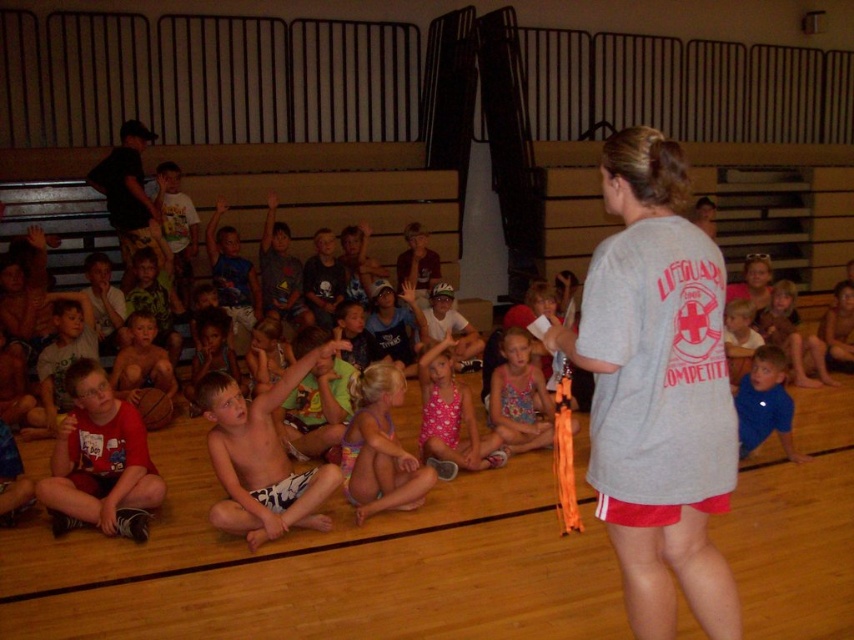
From the picture: You are a teacher in the gymnasium and notice two children wearing blue cotton shirt at lower right and white cotton shirt at center. Which child is positioned to the right of the other?

The blue cotton shirt at lower right is positioned to the right of the white cotton shirt at center.

You are a photographer standing at the entrance of the gymnasium. You want to take a photo of the shiny white shorts at center. Where should you position yourself to ensure the point at coordinates (262, 456) is in the frame?

You should position yourself so that the point at coordinates (262, 456) is centered in your viewfinder because it is located on the shiny white shorts at center.

You are a teacher organizing a group activity and need to hand out swim caps. The blue cotton shirt at lower right and the white cotton shirt at center are two children in your group. Which child has a smaller shirt width, and therefore might need a smaller swim cap?

The blue cotton shirt at lower right has a smaller shirt width than the white cotton shirt at center, so they might need a smaller swim cap.